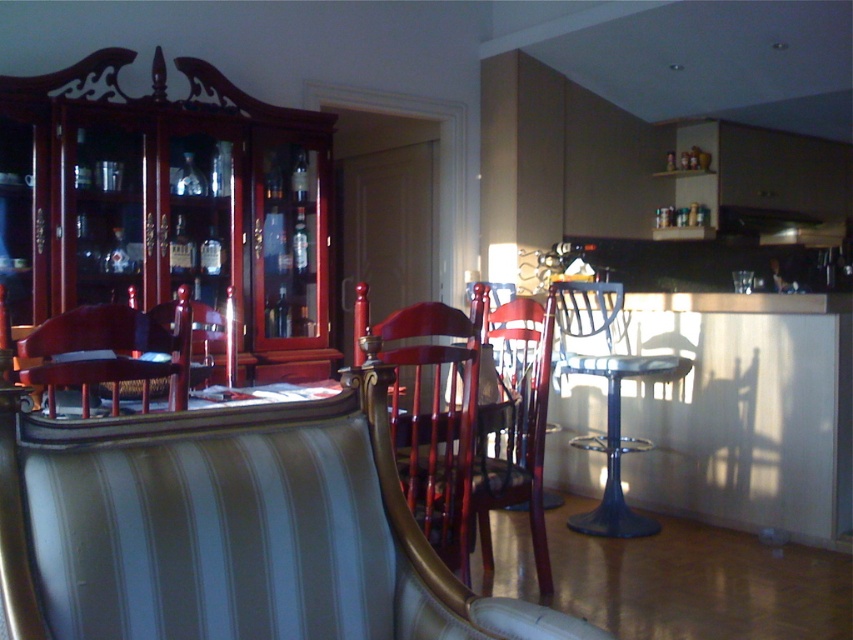
You are a guest entering the dining area and need to sit down. The host points to the wooden chair at center and the metallic blue stool at right. Which one is positioned higher from the floor?

The wooden chair at center is located above the metallic blue stool at right, so the wooden chair at center is higher from the floor.

You are standing in the dining area and need to locate the glossy wood chair at center. According to the coordinates provided, where should you look relative to the striped upholstered bench?

The glossy wood chair at center is located at coordinates point (434, 420), which places it slightly to the right and above the striped upholstered bench in the dining area.